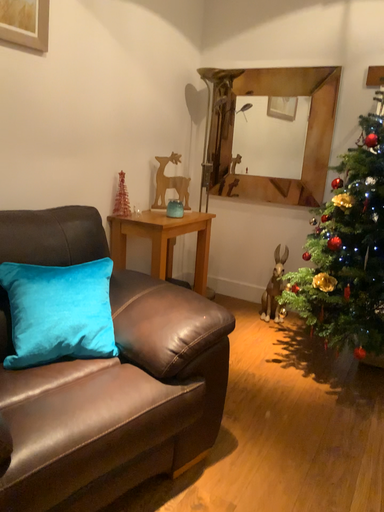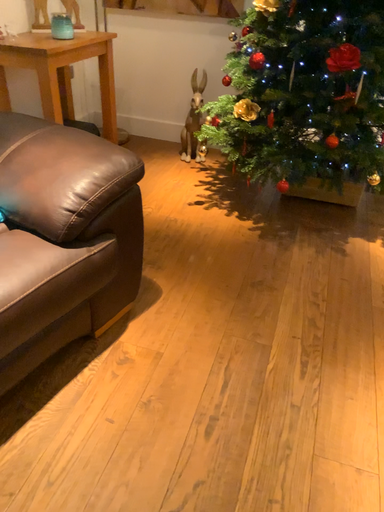
Question: Which way did the camera rotate in the video?

Choices:
 (A) rotated downward
 (B) rotated upward

Answer: (A)